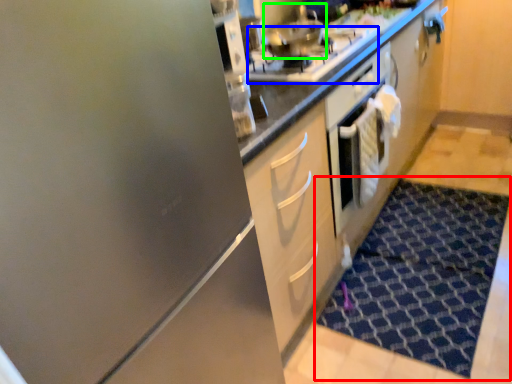
Question: Which object is the closest to the doormat (highlighted by a red box)? Choose among these: gas stove (highlighted by a blue box) or stainless steel (highlighted by a green box).

Choices:
 (A) gas stove
 (B) stainless steel

Answer: (A)